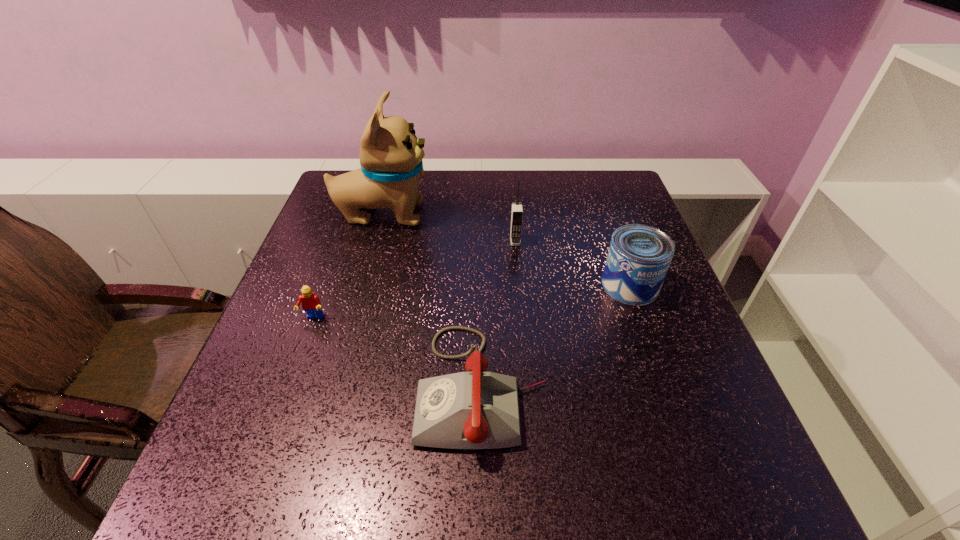
Identify the location of vacant point that satisfies the following two spatial constraints: 1. on the front label of the rightmost object; 2. on the dial of the telephone. The image size is (960, 540). (666, 386).